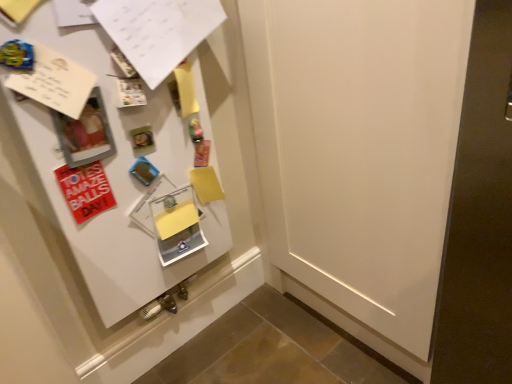
Question: In terms of size, does red matte postcard at left appear bigger or smaller than white paper at upper left?

Choices:
 (A) small
 (B) big

Answer: (A)

Question: From a real-world perspective, is red matte postcard at left above or below white paper at upper left?

Choices:
 (A) above
 (B) below

Answer: (B)

Question: Is red matte postcard at left wider or thinner than white paper at upper left?

Choices:
 (A) thin
 (B) wide

Answer: (A)

Question: Looking at the image, does white paper at upper left seem bigger or smaller compared to red matte postcard at left?

Choices:
 (A) big
 (B) small

Answer: (A)

Question: In the image, is white paper at upper left positioned in front of or behind red matte postcard at left?

Choices:
 (A) front
 (B) behind

Answer: (A)

Question: From the image's perspective, is white paper at upper left positioned above or below red matte postcard at left?

Choices:
 (A) above
 (B) below

Answer: (A)

Question: From a real-world perspective, is white paper at upper left above or below red matte postcard at left?

Choices:
 (A) below
 (B) above

Answer: (B)